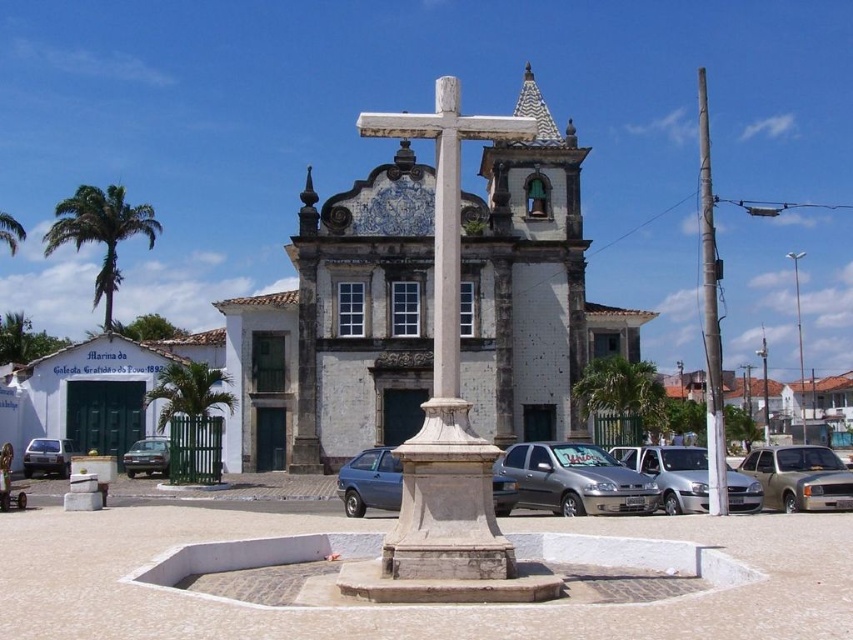
Which is below, green leafy palm tree at left or green leafy palm tree at upper center?

Positioned lower is green leafy palm tree at upper center.

Does green leafy palm tree at left have a smaller size compared to green leafy palm tree at upper center?

Actually, green leafy palm tree at left might be larger than green leafy palm tree at upper center.

Does point (154, 220) come closer to viewer compared to point (654, 396)?

No, it is not.

You are a GUI agent. You are given a task and a screenshot of the screen. Output one action in this format:
    pyautogui.click(x=<x>, y=<y>)
    Task: Click on the green leafy palm tree at left
    The image size is (853, 640).
    Given the screenshot: What is the action you would take?
    pyautogui.click(x=100, y=232)

Between white stone church at center and gold metallic car at center, which one has less height?

Standing shorter between the two is gold metallic car at center.

Is white stone church at center to the right of gold metallic car at center from the viewer's perspective?

In fact, white stone church at center is to the left of gold metallic car at center.

Is point (389, 208) farther from viewer compared to point (770, 454)?

That is True.

Where is `white stone church at center`? white stone church at center is located at coordinates (338, 328).

Is point (498, 497) positioned after point (50, 460)?

No, (498, 497) is in front of (50, 460).

Between silver metallic car at center and silver metallic car at lower left, which one has more height?

silver metallic car at center

Between point (393, 454) and point (33, 440), which one is positioned in front?

Point (393, 454) is more forward.

This screenshot has width=853, height=640. I want to click on silver metallic car at center, so click(x=370, y=481).